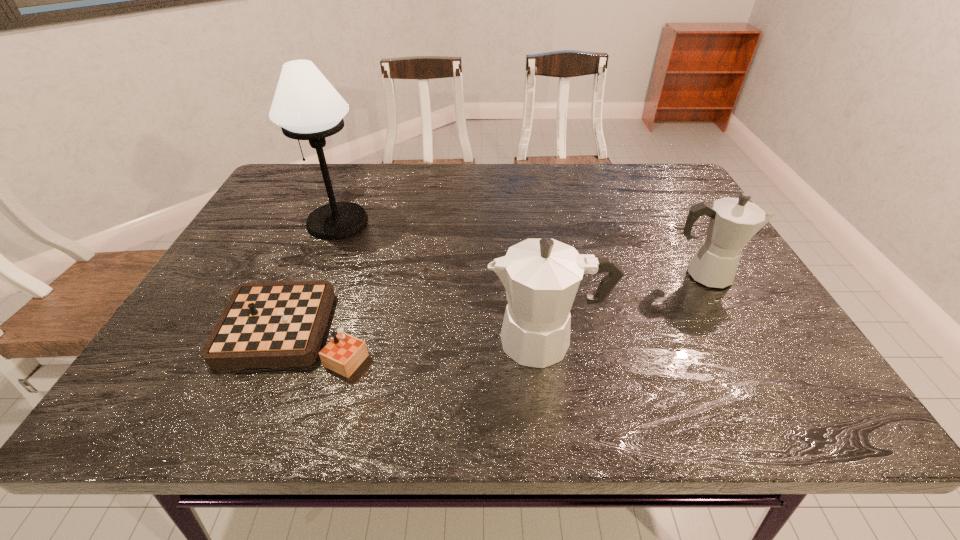
Where is `vacant space at the left edge`? vacant space at the left edge is located at coordinates (231, 267).

You are a GUI agent. You are given a task and a screenshot of the screen. Output one action in this format:
    pyautogui.click(x=<x>, y=<y>)
    Task: Click on the vacant space at the right edge
    This screenshot has height=540, width=960.
    Given the screenshot: What is the action you would take?
    pyautogui.click(x=673, y=245)

Where is `free spot at the far left corner of the desktop`? free spot at the far left corner of the desktop is located at coordinates (297, 180).

You are a GUI agent. You are given a task and a screenshot of the screen. Output one action in this format:
    pyautogui.click(x=<x>, y=<y>)
    Task: Click on the free spot between the farthest object and the shortest object
    
    Given the screenshot: What is the action you would take?
    pyautogui.click(x=319, y=277)

The width and height of the screenshot is (960, 540). Identify the location of unoccupied position between the shortest object and the farthest object. (319, 277).

The width and height of the screenshot is (960, 540). Identify the location of vacant region between the nearer coffeepot and the farthest object. (442, 281).

At what (x,y) coordinates should I click in order to perform the action: click on vacant space that's between the farthest object and the left coffeepot. Please return your answer as a coordinate pair (x, y). The height and width of the screenshot is (540, 960). Looking at the image, I should click on (442, 281).

The width and height of the screenshot is (960, 540). I want to click on vacant space in between the tallest object and the left coffeepot, so click(442, 281).

Identify the location of free spot between the second object from right to left and the table lamp. (442, 281).

In order to click on free spot between the shorter coffeepot and the chessboard in this screenshot , I will do `click(502, 303)`.